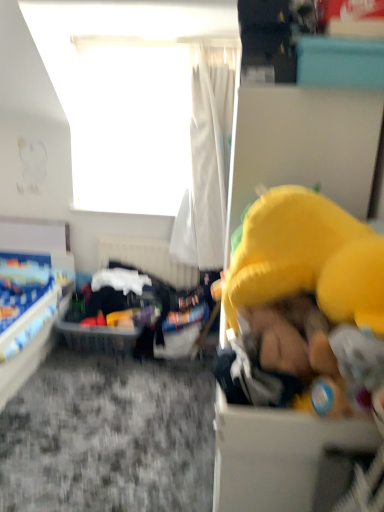
Question: Does point click(289, 413) appear closer or farther from the camera than point click(13, 384)?

Choices:
 (A) farther
 (B) closer

Answer: (B)

Question: Is yellow fabric toy at right, the second box from the top, taller or shorter than blue fabric bed at lower left?

Choices:
 (A) tall
 (B) short

Answer: (B)

Question: Which object is positioned closest to the teal plastic box at upper right, positioned as the first box in right-to-left order?

Choices:
 (A) blue fabric bed at lower left
 (B) yellow plush toy at right
 (C) white fabric bed frame at center
 (D) clear plastic basket at center
 (E) translucent plastic basket at center

Answer: (B)

Question: Which is nearer to the yellow fabric toy at right, which is the second box in back-to-front order?

Choices:
 (A) blue fabric bed at lower left
 (B) white fabric bed frame at center
 (C) clear plastic basket at center
 (D) yellow plush toy at right
 (E) white sheer curtain at upper center

Answer: (D)